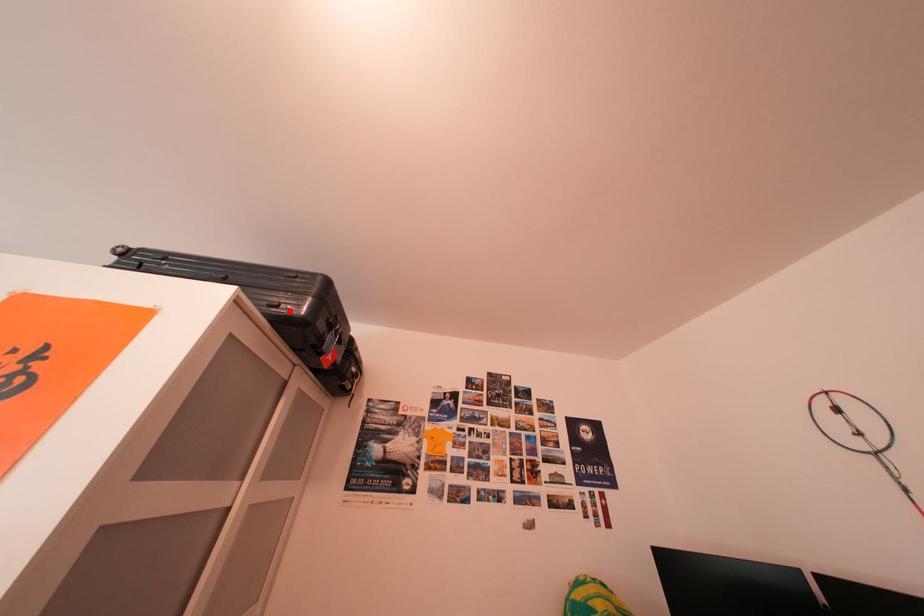
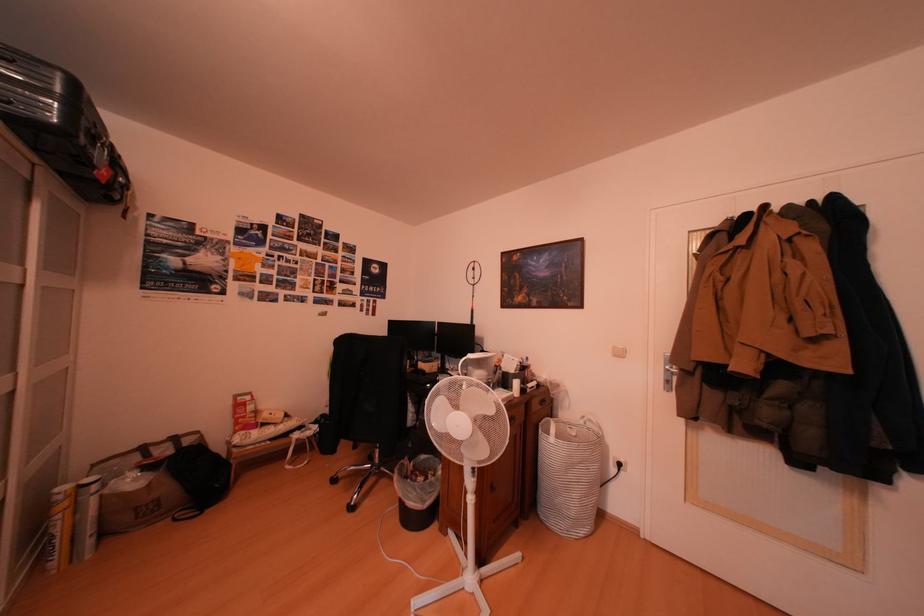
Find the pixel in the second image that matches the highlighted location in the first image.

(19, 108)